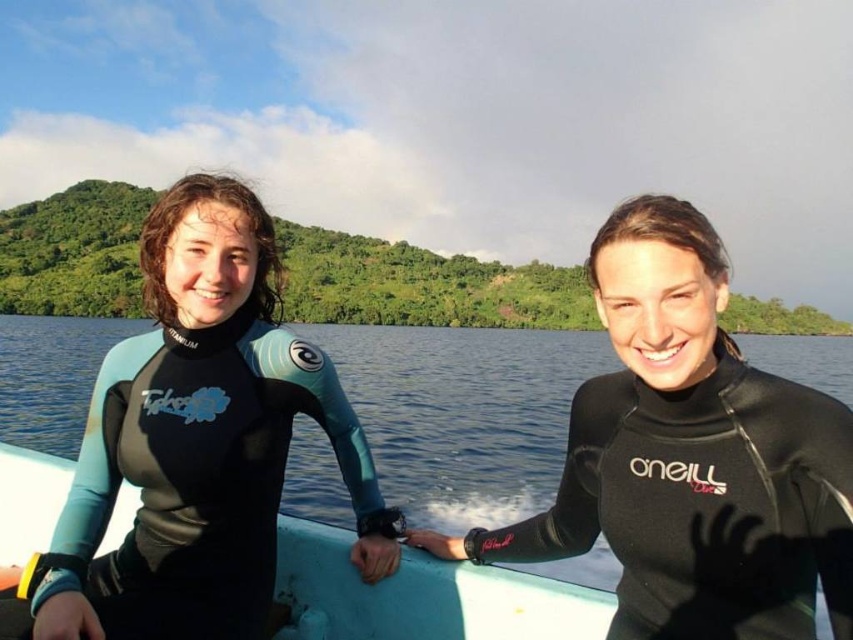
You are navigating a small boat and need to avoid a specific area in the water. According to the image, where exactly is the blue water at center located?

The blue water at center is located at point (x=463, y=412).

You are a photographer trying to capture a wide shot of the blue water at center and the white matte surfboard at center. Which object will appear wider in your photo?

The blue water at center will appear wider in the photo since its width surpasses that of the white matte surfboard at center.

You are a photographer trying to capture a clear shot of the black matte wetsuit at center and the white matte surfboard at center. Since you want the surfboard to be the main focus, which object should you position closer to the camera to ensure it appears larger in the photo?

The black matte wetsuit at center is taller than the white matte surfboard at center. To make the surfboard appear larger, you should position the white matte surfboard at center closer to the camera than the black matte wetsuit at center.